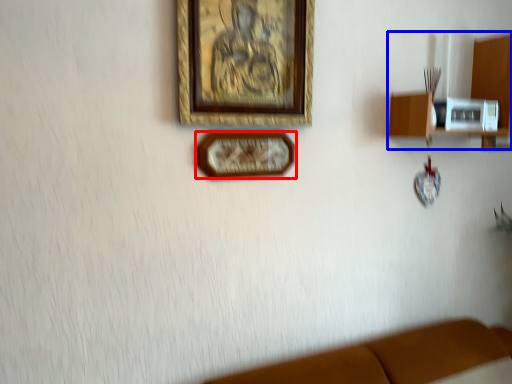
Question: Which object appears farthest to the camera in this image, picture frame (highlighted by a red box) or shelf (highlighted by a blue box)?

Choices:
 (A) picture frame
 (B) shelf

Answer: (B)